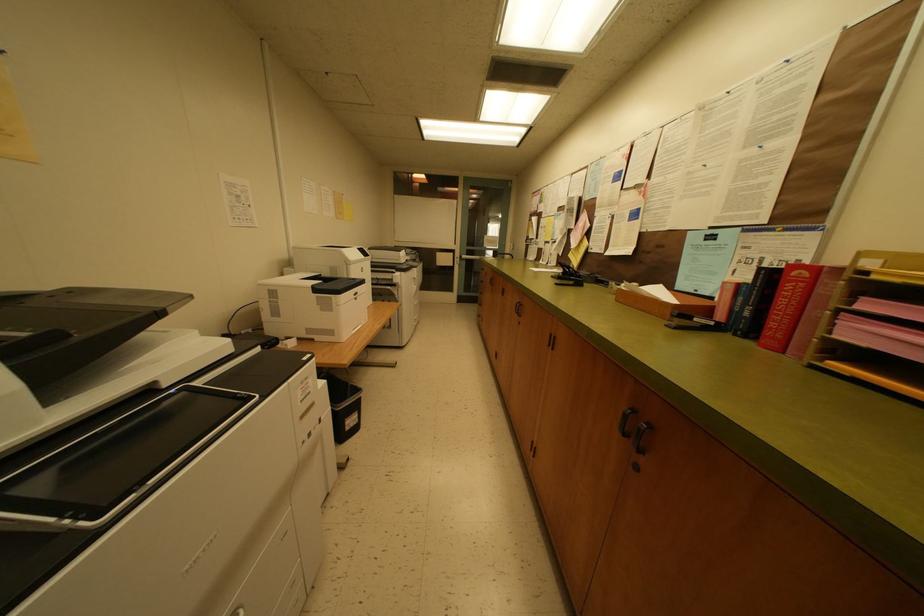
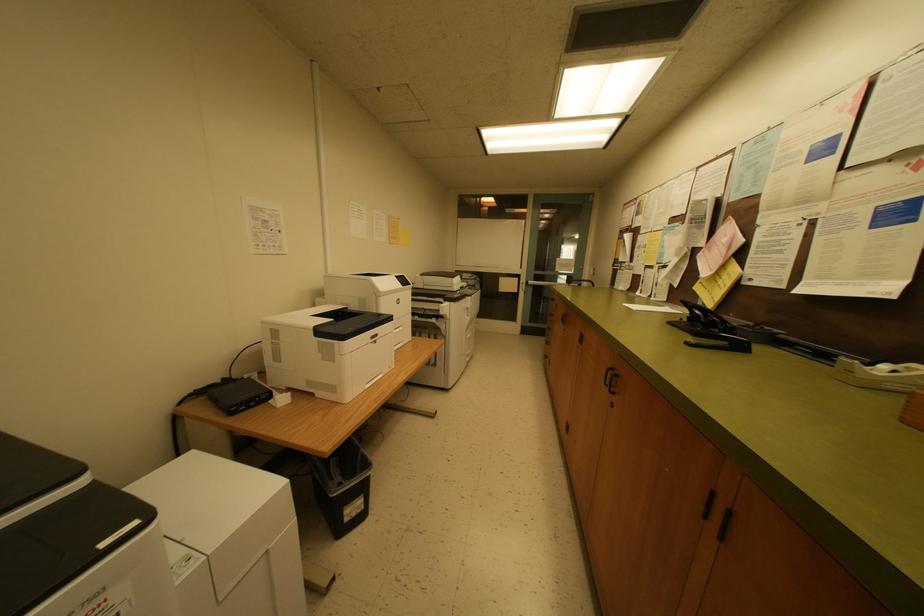
Question: Which direction would the cameraman need to move to produce the second image? Reply with the corresponding letter.

Choices:
 (A) Left
 (B) Right
 (C) Forward
 (D) Backward

Answer: (C)